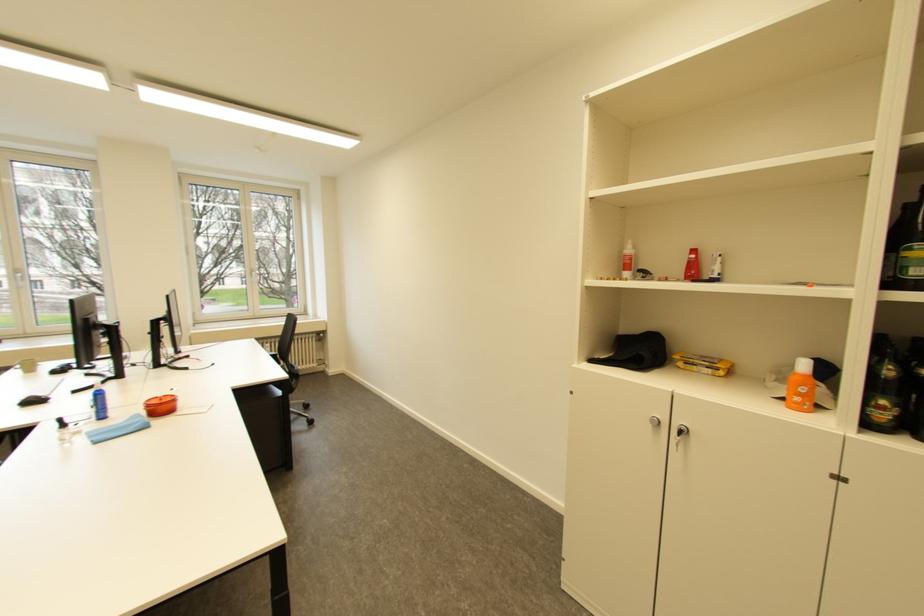
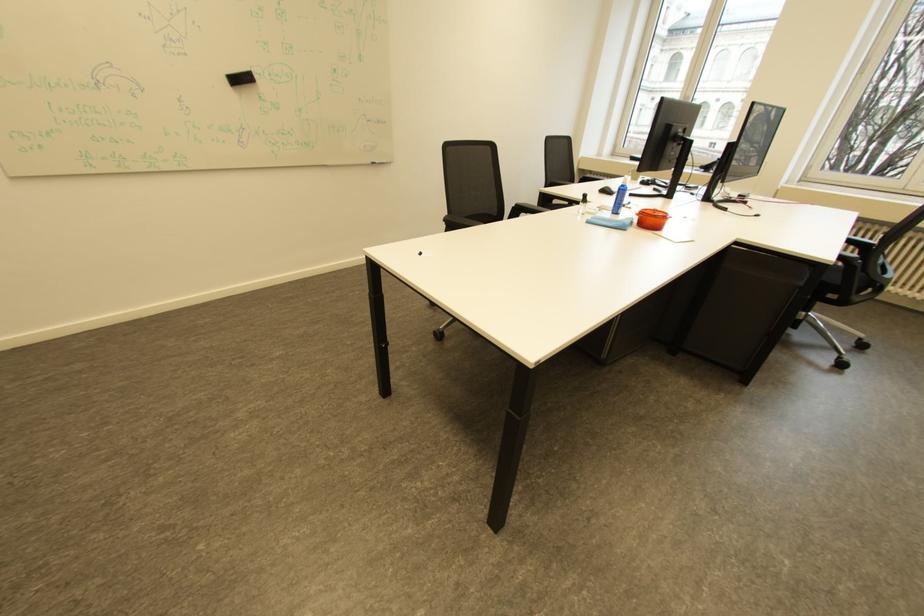
Locate, in the second image, the point that corresponds to point (146, 427) in the first image.

(627, 224)